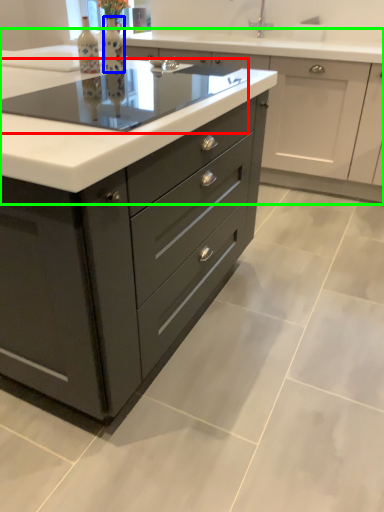
Question: Based on their relative distances, which object is nearer to appliance (highlighted by a red box)? Choose from bottle (highlighted by a blue box) and cabinetry (highlighted by a green box).

Choices:
 (A) bottle
 (B) cabinetry

Answer: (A)